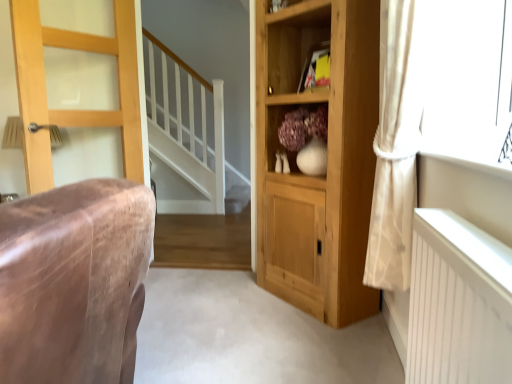
Question: Can you confirm if natural wood cupboard at center is bigger than yellow paper at upper center?

Choices:
 (A) no
 (B) yes

Answer: (B)

Question: Can you confirm if natural wood cupboard at center is wider than yellow paper at upper center?

Choices:
 (A) no
 (B) yes

Answer: (B)

Question: Is natural wood cupboard at center far away from yellow paper at upper center?

Choices:
 (A) no
 (B) yes

Answer: (A)

Question: Is natural wood cupboard at center behind yellow paper at upper center?

Choices:
 (A) no
 (B) yes

Answer: (A)

Question: Is natural wood cupboard at center taller than yellow paper at upper center?

Choices:
 (A) no
 (B) yes

Answer: (B)

Question: From the image's perspective, is natural wood cupboard at center above yellow paper at upper center?

Choices:
 (A) yes
 (B) no

Answer: (B)

Question: Does wooden cabinet at center have a lesser height compared to yellow paper at upper center?

Choices:
 (A) no
 (B) yes

Answer: (A)

Question: Is wooden cabinet at center oriented away from yellow paper at upper center?

Choices:
 (A) yes
 (B) no

Answer: (B)

Question: Is wooden cabinet at center not inside yellow paper at upper center?

Choices:
 (A) yes
 (B) no

Answer: (A)

Question: From the image's perspective, is wooden cabinet at center on yellow paper at upper center?

Choices:
 (A) no
 (B) yes

Answer: (A)

Question: Are wooden cabinet at center and yellow paper at upper center beside each other?

Choices:
 (A) yes
 (B) no

Answer: (B)

Question: Would you say yellow paper at upper center is part of wooden cabinet at center's contents?

Choices:
 (A) no
 (B) yes

Answer: (A)

Question: From the image's perspective, is yellow paper at upper center below light brown wooden door at left?

Choices:
 (A) no
 (B) yes

Answer: (A)